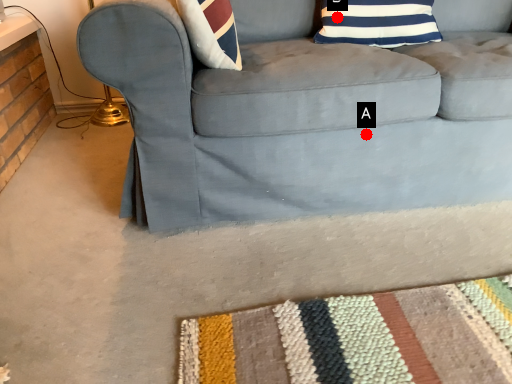
Question: Two points are circled on the image, labeled by A and B beside each circle. Among these points, which one is nearest to the camera?

Choices:
 (A) A is closer
 (B) B is closer

Answer: (A)